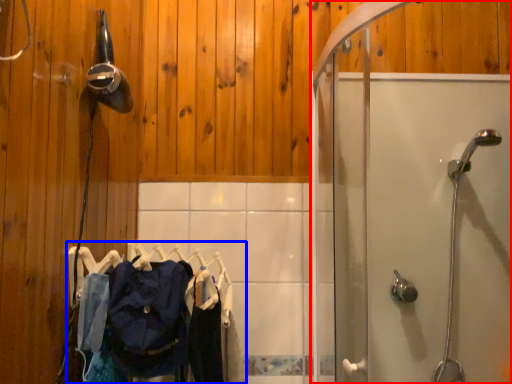
Question: Which object is further to the camera taking this photo, screen door (highlighted by a red box) or laundry (highlighted by a blue box)?

Choices:
 (A) screen door
 (B) laundry

Answer: (B)